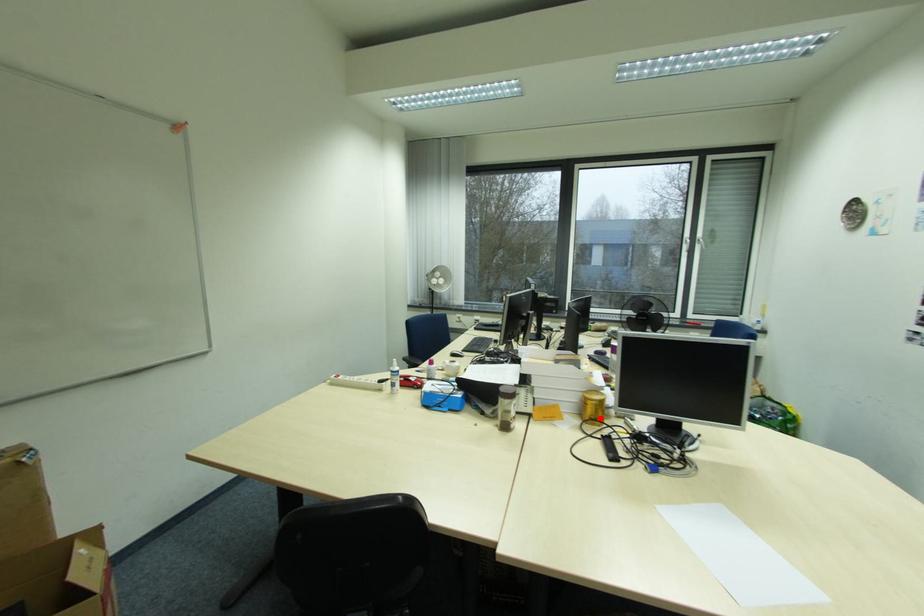
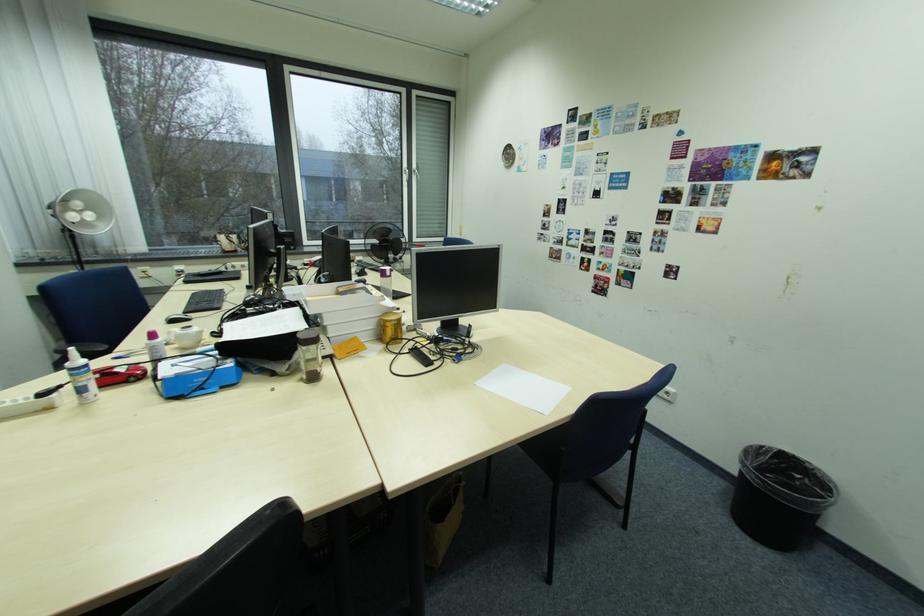
Where in the second image is the point corresponding to the highlighted location from the first image?

(400, 339)